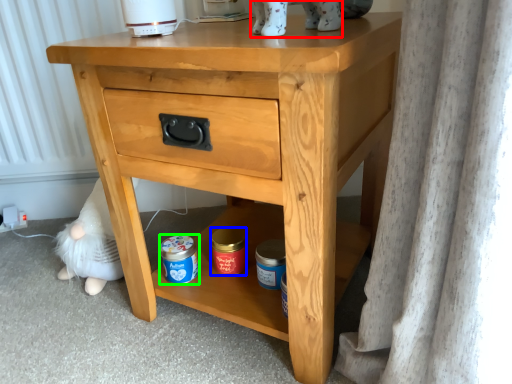
Question: Which is farther away from animal (highlighted by a red box)? pottery (highlighted by a blue box) or glass jar (highlighted by a green box)?

Choices:
 (A) pottery
 (B) glass jar

Answer: (B)